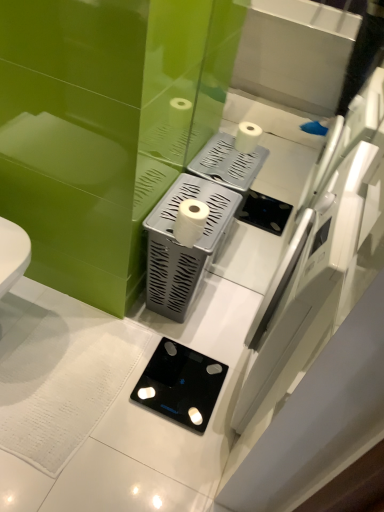
Where is `free spot behind black glass scale at lower center`? The height and width of the screenshot is (512, 384). free spot behind black glass scale at lower center is located at coordinates (196, 326).